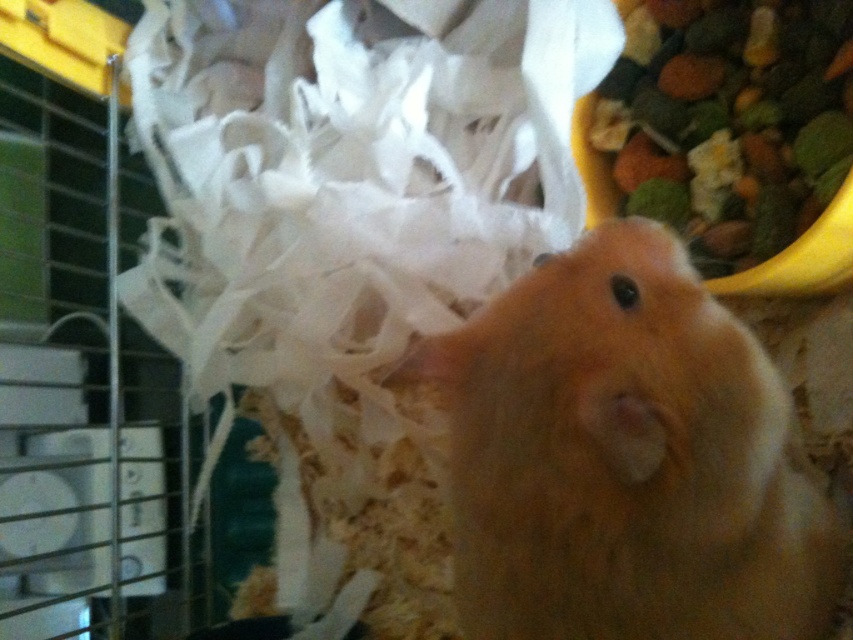
Question: Where is fluffy orange hamster at center located in relation to multicolored grain mix at upper right in the image?

Choices:
 (A) above
 (B) below

Answer: (B)

Question: Which of the following is the closest to the observer?

Choices:
 (A) fluffy orange hamster at center
 (B) multicolored grain mix at upper right

Answer: (A)

Question: Does fluffy orange hamster at center have a larger size compared to multicolored grain mix at upper right?

Choices:
 (A) no
 (B) yes

Answer: (B)

Question: Which point appears closest to the camera in this image?

Choices:
 (A) click(x=453, y=372)
 (B) click(x=814, y=260)

Answer: (A)

Question: Can you confirm if fluffy orange hamster at center is positioned to the left of multicolored grain mix at upper right?

Choices:
 (A) yes
 (B) no

Answer: (A)